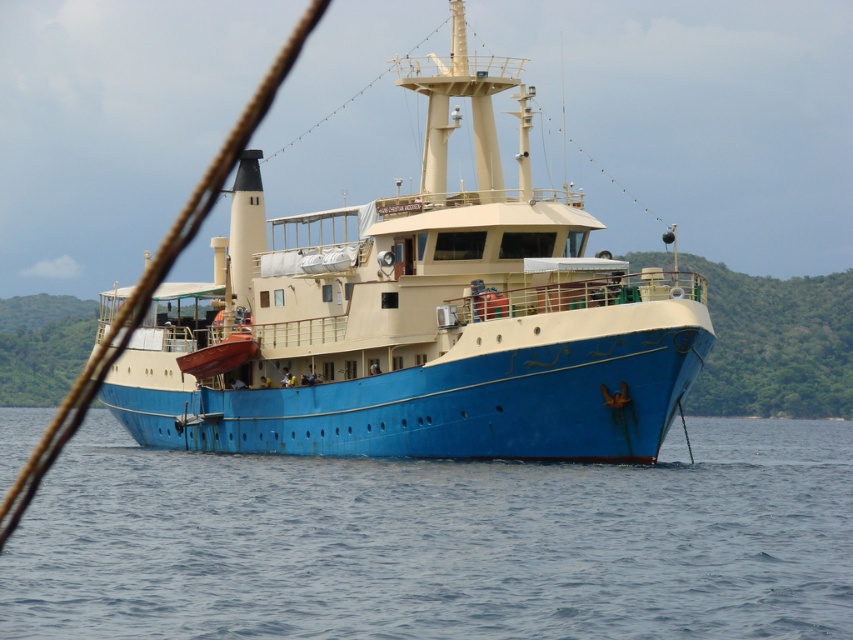
Question: Which object is closer to the camera taking this photo?

Choices:
 (A) blue matte water at lower center
 (B) blue matte boat at center

Answer: (A)

Question: Is blue matte water at lower center positioned before blue matte boat at center?

Choices:
 (A) no
 (B) yes

Answer: (B)

Question: Which object is closer to the camera taking this photo?

Choices:
 (A) blue matte water at lower center
 (B) blue matte boat at center

Answer: (A)

Question: Which of the following is the closest to the observer?

Choices:
 (A) 328,348
 (B) 589,497

Answer: (B)

Question: Can you confirm if blue matte water at lower center is wider than blue matte boat at center?

Choices:
 (A) no
 (B) yes

Answer: (B)

Question: Can you confirm if blue matte water at lower center is positioned below blue matte boat at center?

Choices:
 (A) yes
 (B) no

Answer: (A)